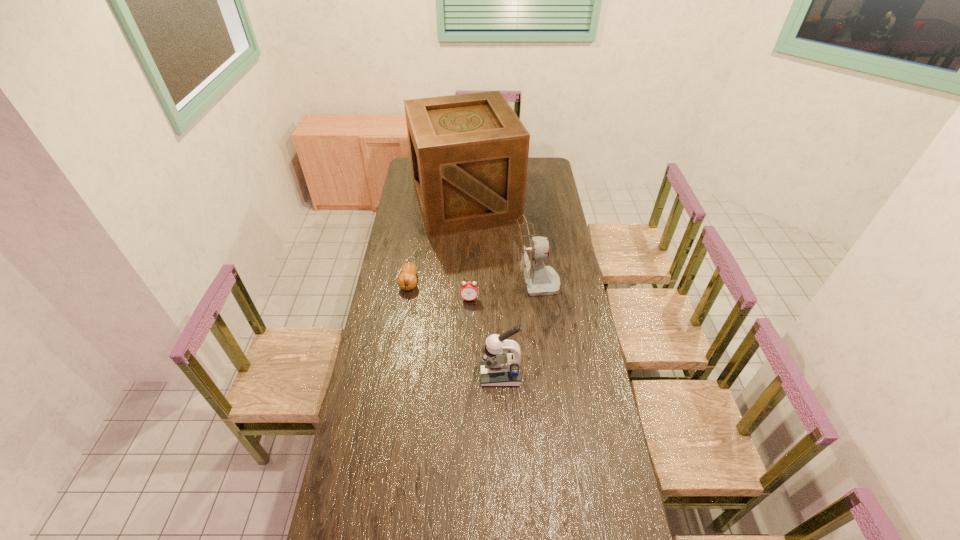
This screenshot has height=540, width=960. In order to click on the second closest object relative to the nearest object in this screenshot , I will do `click(469, 291)`.

The height and width of the screenshot is (540, 960). I want to click on object that is the closest to the gourd, so click(x=469, y=291).

Find the location of a particular element. The width and height of the screenshot is (960, 540). vacant position in the image that satisfies the following two spatial constraints: 1. in front of the fan to blow air; 2. on the front side of the nearest object is located at coordinates (546, 373).